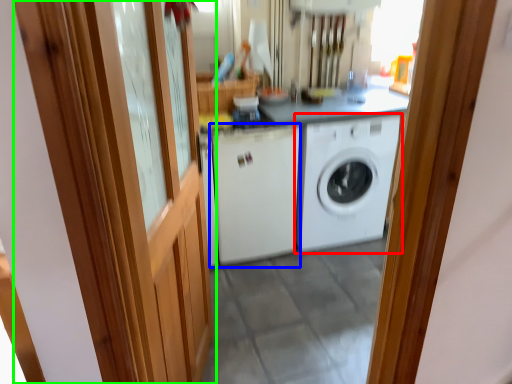
Question: Estimate the real-world distances between objects in this image. Which object is closer to washing machine (highlighted by a red box), washing machine (highlighted by a blue box) or barn door (highlighted by a green box)?

Choices:
 (A) washing machine
 (B) barn door

Answer: (A)